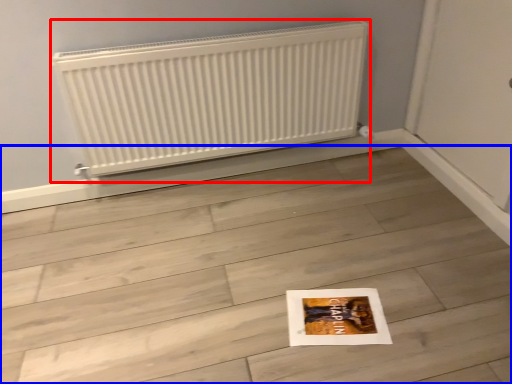
Question: Among these objects, which one is nearest to the camera, radiator (highlighted by a red box) or tile (highlighted by a blue box)?

Choices:
 (A) radiator
 (B) tile

Answer: (B)